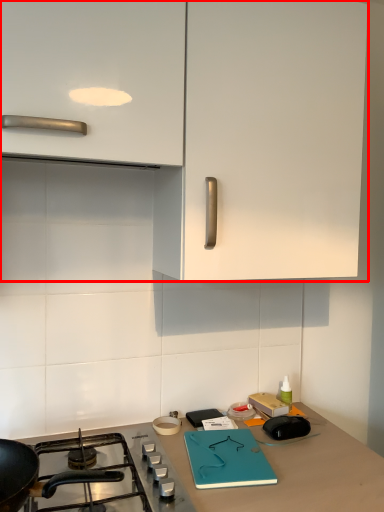
Question: Observing the image, what is the correct spatial positioning of cabinetry (annotated by the red box) in reference to gas stove?

Choices:
 (A) right
 (B) left

Answer: (A)